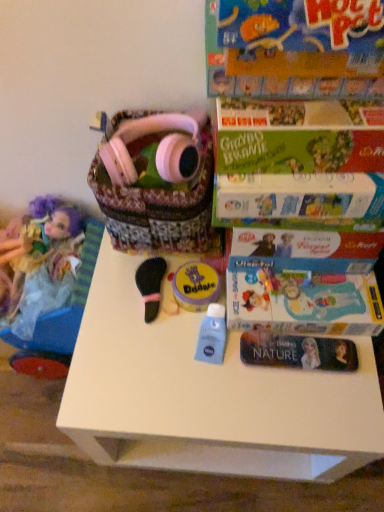
Locate an element on the screen. vacant area that is in front of pink fabric basket at upper center is located at coordinates (130, 323).